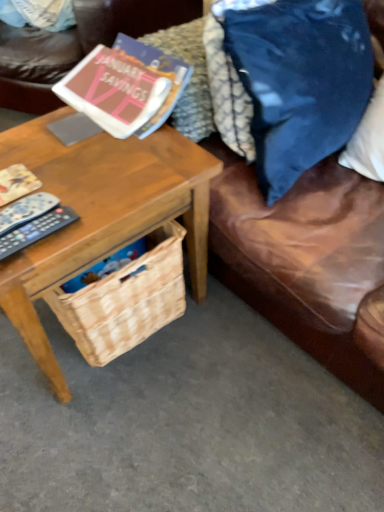
Locate an element on the screen. free location to the right of woodenobject at left is located at coordinates (248, 365).